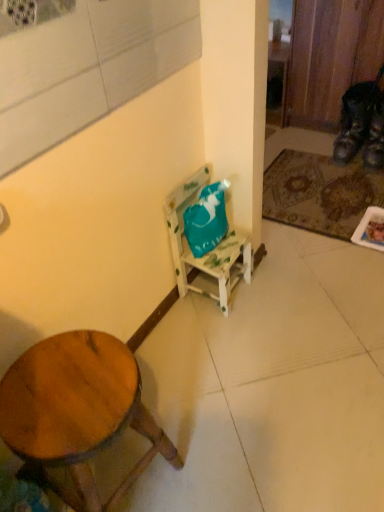
The width and height of the screenshot is (384, 512). Describe the element at coordinates (375, 136) in the screenshot. I see `leather at right, placed as the 1th shoe when sorted from right to left` at that location.

The image size is (384, 512). What do you see at coordinates (354, 120) in the screenshot?
I see `leather brown shoe at lower right, marked as the second shoe in a right-to-left arrangement` at bounding box center [354, 120].

Measure the distance between leather brown shoe at lower right, marked as the second shoe in a right-to-left arrangement, and camera.

The depth of leather brown shoe at lower right, marked as the second shoe in a right-to-left arrangement, is 7.09 feet.

Where is `leather at right, placed as the 1th shoe when sorted from right to left`? The height and width of the screenshot is (512, 384). leather at right, placed as the 1th shoe when sorted from right to left is located at coordinates (375, 136).

Consider the image. Considering the relative positions of leather brown shoe at lower right, marked as the second shoe in a right-to-left arrangement, and brown textured mat at lower right in the image provided, is leather brown shoe at lower right, marked as the second shoe in a right-to-left arrangement, to the right of brown textured mat at lower right from the viewer's perspective?

Indeed, leather brown shoe at lower right, marked as the second shoe in a right-to-left arrangement, is positioned on the right side of brown textured mat at lower right.

Considering the relative sizes of leather brown shoe at lower right, marked as the second shoe in a right-to-left arrangement, and brown textured mat at lower right in the image provided, is leather brown shoe at lower right, marked as the second shoe in a right-to-left arrangement, taller than brown textured mat at lower right?

Correct, leather brown shoe at lower right, marked as the second shoe in a right-to-left arrangement, is much taller as brown textured mat at lower right.

From a real-world perspective, is leather brown shoe at lower right, marked as the second shoe in a right-to-left arrangement, below brown textured mat at lower right?

Incorrect, from a real-world perspective, leather brown shoe at lower right, marked as the second shoe in a right-to-left arrangement, is higher than brown textured mat at lower right.

Is leather brown shoe at lower right, acting as the 1th shoe starting from the left, inside or outside of brown textured mat at lower right?

leather brown shoe at lower right, acting as the 1th shoe starting from the left, is not inside brown textured mat at lower right, it's outside.

In terms of height, does teal fabric bag at center look taller or shorter compared to wooden stool at lower left?

teal fabric bag at center is taller than wooden stool at lower left.

Consider the image. Does teal fabric bag at center have a larger size compared to wooden stool at lower left?

No.

Which is in front, teal fabric bag at center or wooden stool at lower left?

wooden stool at lower left is more forward.

Based on their sizes in the image, would you say leather brown shoe at lower right, acting as the 1th shoe starting from the left, is bigger or smaller than leather at right, placed as the 1th shoe when sorted from right to left?

Considering their sizes, leather brown shoe at lower right, acting as the 1th shoe starting from the left, takes up more space than leather at right, placed as the 1th shoe when sorted from right to left.

Measure the distance from leather brown shoe at lower right, acting as the 1th shoe starting from the left, to leather at right, placed as the 1th shoe when sorted from right to left.

leather brown shoe at lower right, acting as the 1th shoe starting from the left, is 3.32 inches away from leather at right, placed as the 1th shoe when sorted from right to left.

Is leather at right, which ranks as the second shoe in left-to-right order, a part of leather brown shoe at lower right, acting as the 1th shoe starting from the left?

No, leather brown shoe at lower right, acting as the 1th shoe starting from the left, does not contain leather at right, which ranks as the second shoe in left-to-right order.

Consider the image. Which of these two, teal fabric bag at center or leather at right, placed as the 1th shoe when sorted from right to left, stands taller?

teal fabric bag at center.

At what (x,y) coordinates should I click in order to perform the action: click on chair in front of the leather at right, which ranks as the second shoe in left-to-right order. Please return your answer as a coordinate pair (x, y). Looking at the image, I should click on (210, 250).

Which is correct: teal fabric bag at center is inside leather at right, placed as the 1th shoe when sorted from right to left, or outside of it?

teal fabric bag at center lies outside leather at right, placed as the 1th shoe when sorted from right to left.

Consider the image. Which is nearer, (170, 220) or (376, 159)?

Point (170, 220).

Consider the image. Which is nearer, (x=64, y=492) or (x=357, y=92)?

The point (x=64, y=492) is closer to the camera.

Can you tell me how much wooden stool at lower left and leather brown shoe at lower right, acting as the 1th shoe starting from the left, differ in facing direction?

89 degrees.

Between wooden stool at lower left and leather brown shoe at lower right, marked as the second shoe in a right-to-left arrangement, which one has larger size?

Bigger between the two is wooden stool at lower left.

From the image's perspective, who appears lower, wooden stool at lower left or leather brown shoe at lower right, marked as the second shoe in a right-to-left arrangement?

From the image's view, wooden stool at lower left is below.

In terms of width, does teal fabric bag at center look wider or thinner when compared to leather brown shoe at lower right, acting as the 1th shoe starting from the left?

Clearly, teal fabric bag at center has less width compared to leather brown shoe at lower right, acting as the 1th shoe starting from the left.

From a real-world perspective, is teal fabric bag at center positioned over leather brown shoe at lower right, acting as the 1th shoe starting from the left, based on gravity?

Yes, from a real-world perspective, teal fabric bag at center is above leather brown shoe at lower right, acting as the 1th shoe starting from the left.

Does teal fabric bag at center have a lesser height compared to leather brown shoe at lower right, acting as the 1th shoe starting from the left?

Incorrect, the height of teal fabric bag at center does not fall short of that of leather brown shoe at lower right, acting as the 1th shoe starting from the left.

Locate an element on the screen. The width and height of the screenshot is (384, 512). mat located underneath the wooden stool at lower left (from a real-world perspective) is located at coordinates (320, 193).

Can you confirm if wooden stool at lower left is thinner than brown textured mat at lower right?

Indeed, wooden stool at lower left has a lesser width compared to brown textured mat at lower right.

Is wooden stool at lower left in front of brown textured mat at lower right?

Yes, the depth of wooden stool at lower left is less than that of brown textured mat at lower right.

Between wooden stool at lower left and brown textured mat at lower right, which one has more height?

Standing taller between the two is wooden stool at lower left.

Locate an element on the screen. This screenshot has height=512, width=384. mat below the leather brown shoe at lower right, acting as the 1th shoe starting from the left (from the image's perspective) is located at coordinates (320, 193).

The width and height of the screenshot is (384, 512). What are the coordinates of `chair located on the right of wooden stool at lower left` in the screenshot? It's located at (210, 250).

When comparing their distances from leather brown shoe at lower right, acting as the 1th shoe starting from the left, does wooden stool at lower left or brown textured mat at lower right seem closer?

brown textured mat at lower right is positioned closer to the anchor leather brown shoe at lower right, acting as the 1th shoe starting from the left.

Looking at the image, which one is located closer to brown textured mat at lower right, leather brown shoe at lower right, acting as the 1th shoe starting from the left, or leather at right, placed as the 1th shoe when sorted from right to left?

leather brown shoe at lower right, acting as the 1th shoe starting from the left, lies closer to brown textured mat at lower right than the other object.

When comparing their distances from wooden stool at lower left, does leather at right, placed as the 1th shoe when sorted from right to left, or leather brown shoe at lower right, marked as the second shoe in a right-to-left arrangement, seem closer?

The object closer to wooden stool at lower left is leather at right, placed as the 1th shoe when sorted from right to left.

Considering their positions, is wooden stool at lower left positioned closer to leather at right, which ranks as the second shoe in left-to-right order, than leather brown shoe at lower right, marked as the second shoe in a right-to-left arrangement?

The object closer to leather at right, which ranks as the second shoe in left-to-right order, is leather brown shoe at lower right, marked as the second shoe in a right-to-left arrangement.

When comparing their distances from leather at right, placed as the 1th shoe when sorted from right to left, does leather brown shoe at lower right, marked as the second shoe in a right-to-left arrangement, or teal fabric bag at center seem closer?

Among the two, leather brown shoe at lower right, marked as the second shoe in a right-to-left arrangement, is located nearer to leather at right, placed as the 1th shoe when sorted from right to left.

Which object lies further to the anchor point wooden stool at lower left, leather brown shoe at lower right, marked as the second shoe in a right-to-left arrangement, or brown textured mat at lower right?

leather brown shoe at lower right, marked as the second shoe in a right-to-left arrangement, lies further to wooden stool at lower left than the other object.

From the image, which object appears to be farther from leather brown shoe at lower right, acting as the 1th shoe starting from the left, leather at right, which ranks as the second shoe in left-to-right order, or brown textured mat at lower right?

brown textured mat at lower right is positioned further to the anchor leather brown shoe at lower right, acting as the 1th shoe starting from the left.

Based on their spatial positions, is teal fabric bag at center or leather at right, which ranks as the second shoe in left-to-right order, further from brown textured mat at lower right?

Based on the image, teal fabric bag at center appears to be further to brown textured mat at lower right.

Locate an element on the screen. This screenshot has width=384, height=512. chair between wooden stool at lower left and leather brown shoe at lower right, marked as the second shoe in a right-to-left arrangement, in the front-back direction is located at coordinates (210, 250).

Where is `mat between wooden stool at lower left and leather brown shoe at lower right, marked as the second shoe in a right-to-left arrangement, from front to back`? mat between wooden stool at lower left and leather brown shoe at lower right, marked as the second shoe in a right-to-left arrangement, from front to back is located at coordinates (320, 193).

At what (x,y) coordinates should I click in order to perform the action: click on shoe located between wooden stool at lower left and leather brown shoe at lower right, marked as the second shoe in a right-to-left arrangement, in the depth direction. Please return your answer as a coordinate pair (x, y). Image resolution: width=384 pixels, height=512 pixels. Looking at the image, I should click on (375, 136).

Locate an element on the screen. The image size is (384, 512). mat positioned between wooden stool at lower left and leather at right, which ranks as the second shoe in left-to-right order, from near to far is located at coordinates (320, 193).